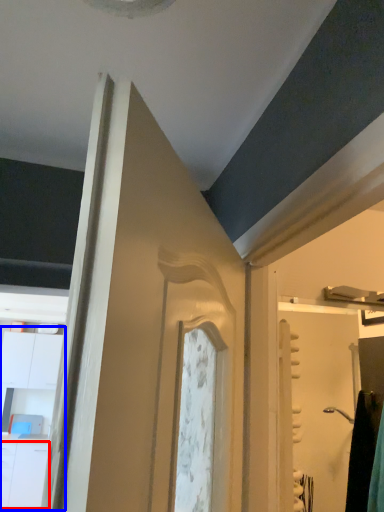
Question: Which of the following is the farthest to the observer, drawer (highlighted by a red box) or dresser (highlighted by a blue box)?

Choices:
 (A) drawer
 (B) dresser

Answer: (B)